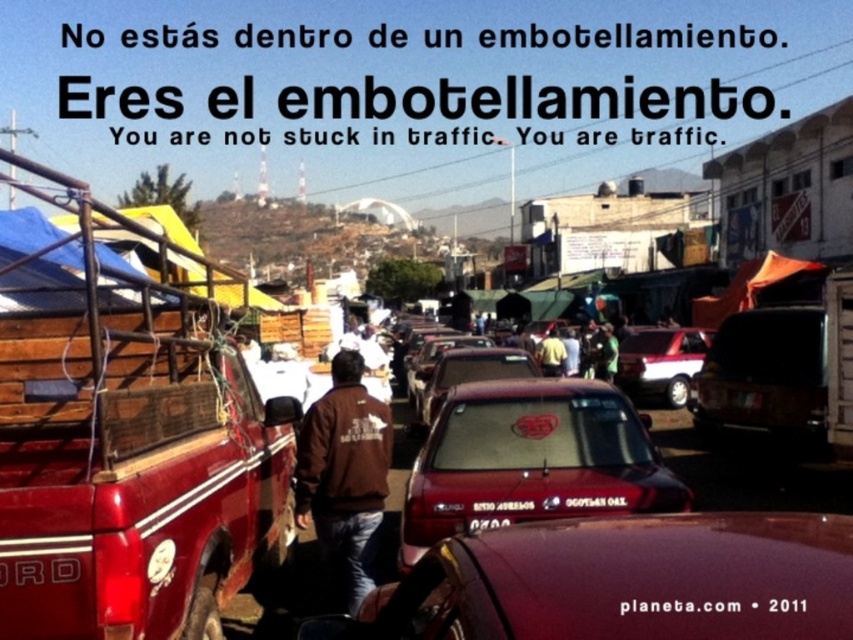
You are a driver in the satin brown car at center. You want to exit the traffic jam. Is the metallic silver car at center blocking your path?

The satin brown car at center is behind the metallic silver car at center, so yes, the metallic silver car at center is blocking the path of the satin brown car at center.

You are a delivery driver who needs to park your car between the metallic red car at center and the satin brown car at center. Given that your car is 1.8 meters wide, can you fit your car in the space between them?

The metallic red car at center has a lesser width compared to satin brown car at center, so the space between them may be sufficient for your 1.8 meter wide car. However, without knowing the exact distance between the cars, it is uncertain if the space is enough.